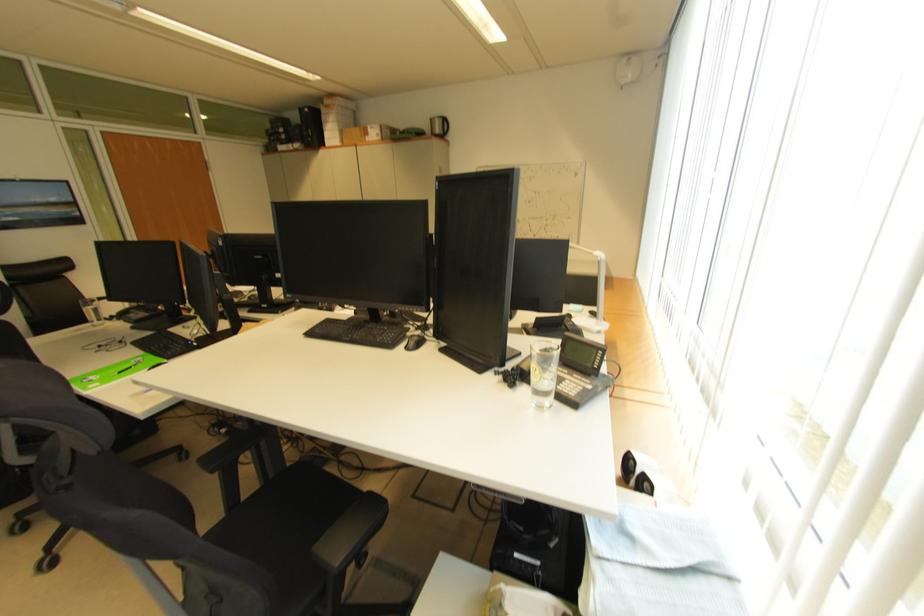
Describe the element at coordinates (350, 533) in the screenshot. I see `a black chair armrest` at that location.